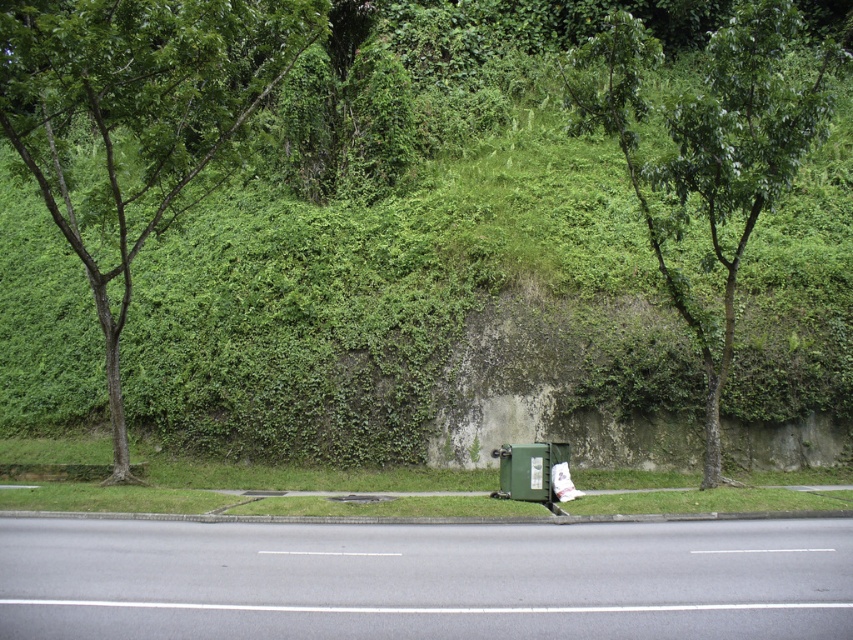
What do you see at coordinates (135, 122) in the screenshot?
I see `green leafy tree at left` at bounding box center [135, 122].

Locate an element on the screen. This screenshot has height=640, width=853. green leafy tree at left is located at coordinates (135, 122).

Is green leafy hillside at center in front of green leafy tree at left?

No.

At what (x,y) coordinates should I click in order to perform the action: click on green leafy hillside at center. Please return your answer as a coordinate pair (x, y). This screenshot has height=640, width=853. Looking at the image, I should click on (422, 220).

The image size is (853, 640). I want to click on green leafy hillside at center, so click(x=422, y=220).

Can you confirm if green leafy hillside at center is shorter than green leafy tree at center?

No.

Between point (474, 44) and point (721, 170), which one is positioned behind?

The point (474, 44) is more distant.

Find the location of a particular element. The image size is (853, 640). green leafy hillside at center is located at coordinates (422, 220).